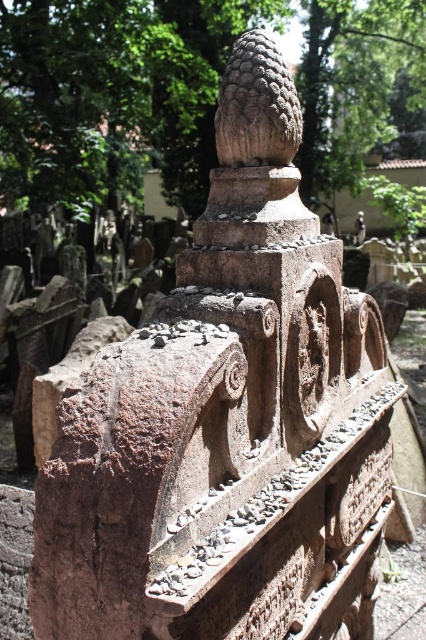
You are an archaeologist examining the cemetery structure. You notice two stone cones on the structure. The brown stone cone at center and the rough stone cone at upper center. Which one do you think has a larger base diameter?

The brown stone cone at center might be wider than the rough stone cone at upper center, so it likely has a larger base diameter.

You are a photographer standing in front of the cemetery structure. You want to capture both point (x=422, y=70) and point (x=287, y=147) in your photo. Which point will appear closer to the bottom edge of the photo?

Point (x=287, y=147) will appear closer to the bottom edge of the photo because it is closer to the camera than point (x=422, y=70).